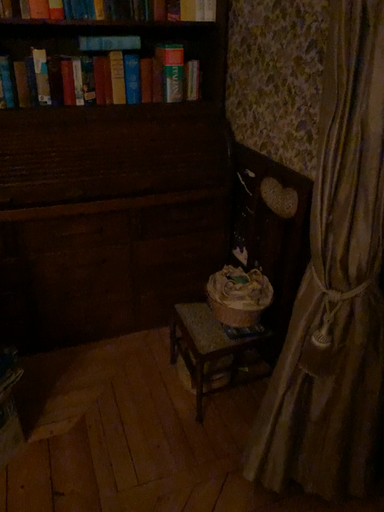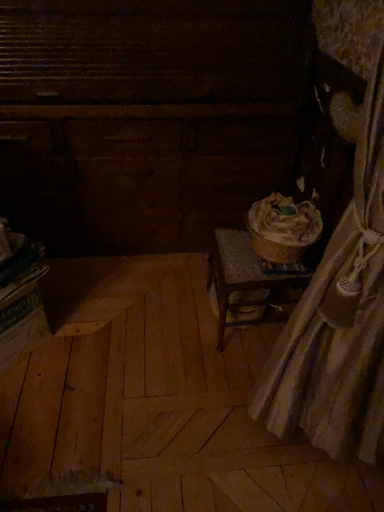
Question: Which way did the camera rotate in the video?

Choices:
 (A) rotated left
 (B) rotated right

Answer: (A)